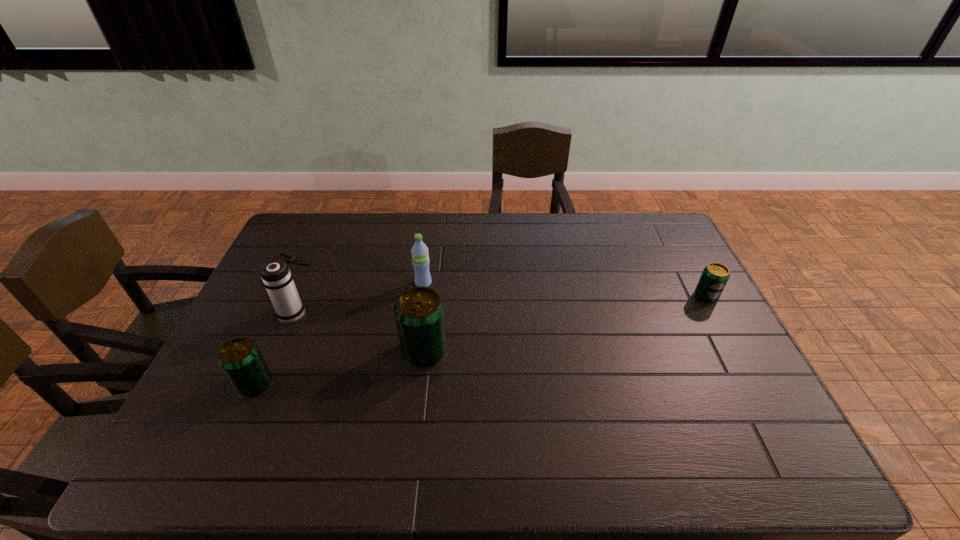
Identify the location of the third shortest object. Image resolution: width=960 pixels, height=540 pixels. (241, 360).

You are a GUI agent. You are given a task and a screenshot of the screen. Output one action in this format:
    pyautogui.click(x=<x>, y=<y>)
    Task: Click on the leftmost beer can
    Image resolution: width=960 pixels, height=540 pixels.
    Given the screenshot: What is the action you would take?
    pyautogui.click(x=241, y=360)

At what (x,y) coordinates should I click in order to perform the action: click on the tallest beer can. Please return your answer as a coordinate pair (x, y). Image resolution: width=960 pixels, height=540 pixels. Looking at the image, I should click on (419, 312).

Image resolution: width=960 pixels, height=540 pixels. Find the location of `the farthest beer can`. the farthest beer can is located at coordinates (715, 276).

At what (x,y) coordinates should I click in order to perform the action: click on the shortest beer can. Please return your answer as a coordinate pair (x, y). The height and width of the screenshot is (540, 960). Looking at the image, I should click on [x=715, y=276].

Image resolution: width=960 pixels, height=540 pixels. In order to click on the shortest object in this screenshot , I will do `click(295, 260)`.

What are the coordinates of `the farthest object` in the screenshot? It's located at (295, 260).

You are a GUI agent. You are given a task and a screenshot of the screen. Output one action in this format:
    pyautogui.click(x=<x>, y=<y>)
    Task: Click on the water bottle
    The width and height of the screenshot is (960, 540).
    Given the screenshot: What is the action you would take?
    pyautogui.click(x=420, y=256)

Where is `thermos bottle`? This screenshot has width=960, height=540. thermos bottle is located at coordinates (276, 276).

Find the location of a particular element. This screenshot has height=540, width=960. vacant area situated on the right of the leftmost beer can is located at coordinates (372, 383).